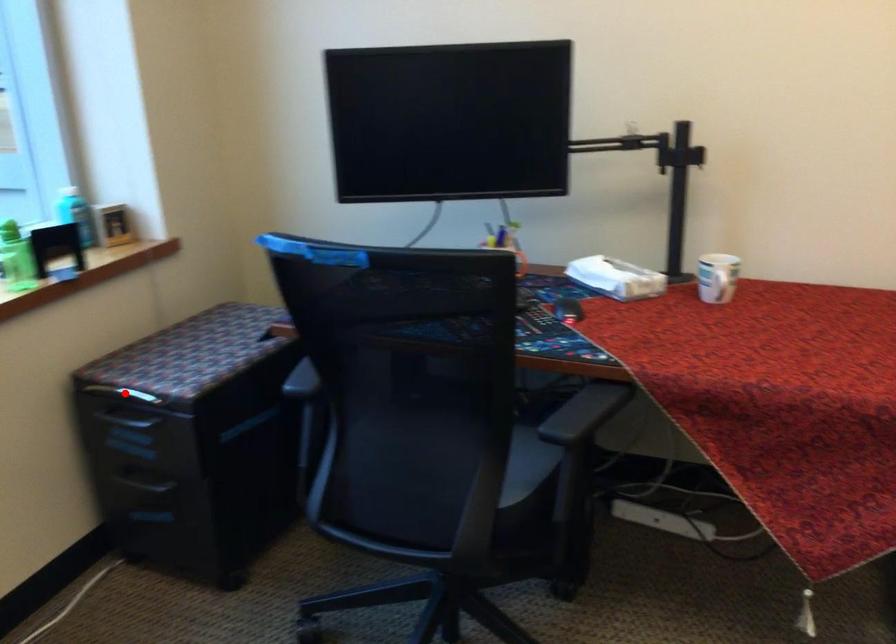
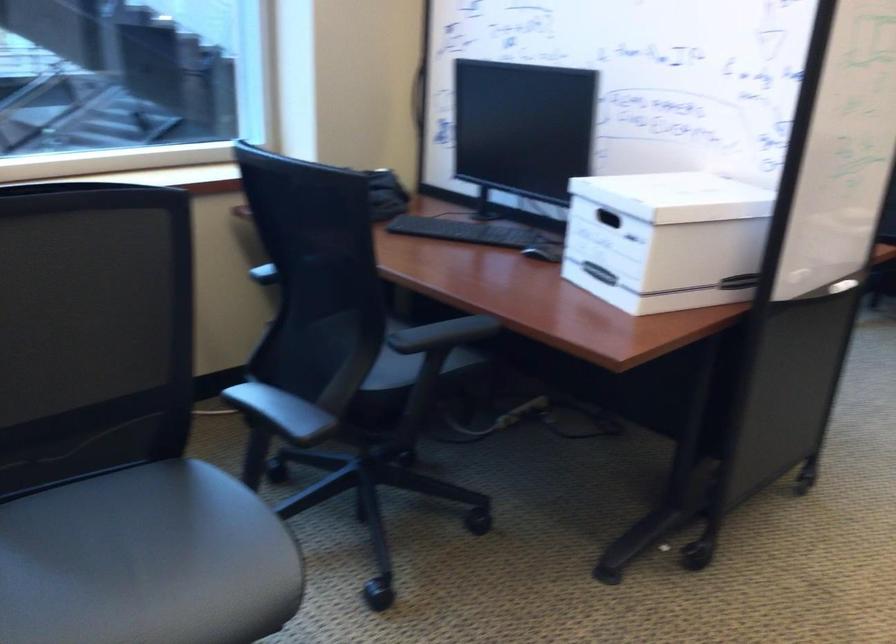
Question: I am providing you with two images of the same scene from different viewpoints. A red point is marked on the first image. Is the red point's position out of view in image 2?

Choices:
 (A) Yes
 (B) No

Answer: (A)